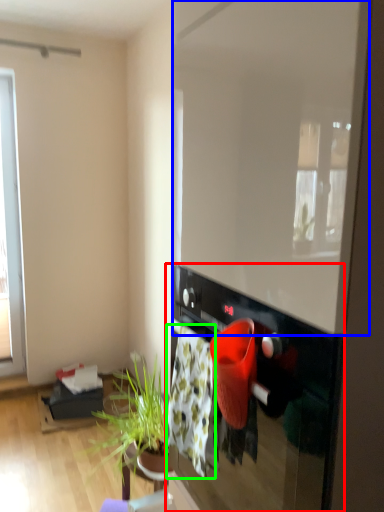
Question: Estimate the real-world distances between objects in this image. Which object is closer to oven (highlighted by a red box), window screen (highlighted by a blue box) or blanket (highlighted by a green box)?

Choices:
 (A) window screen
 (B) blanket

Answer: (B)